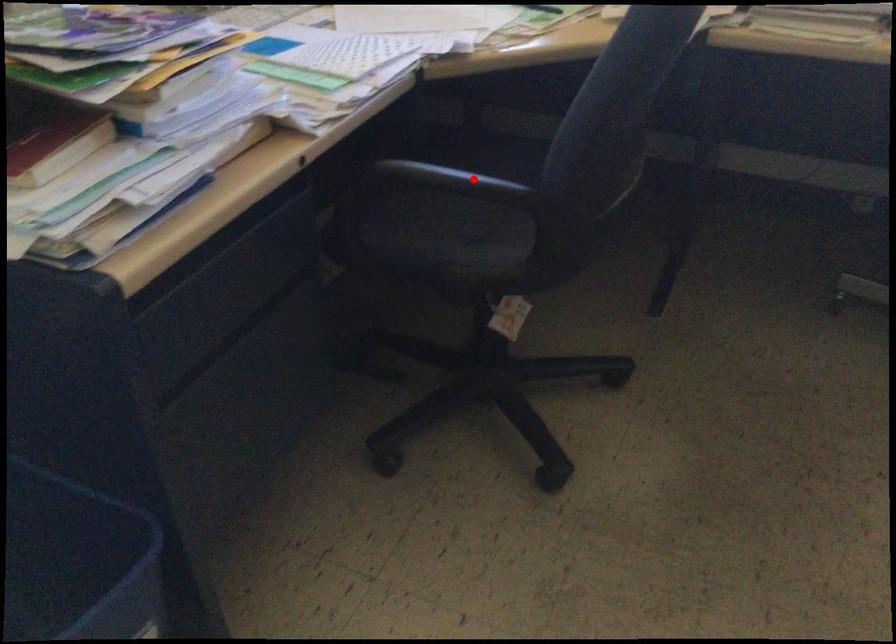
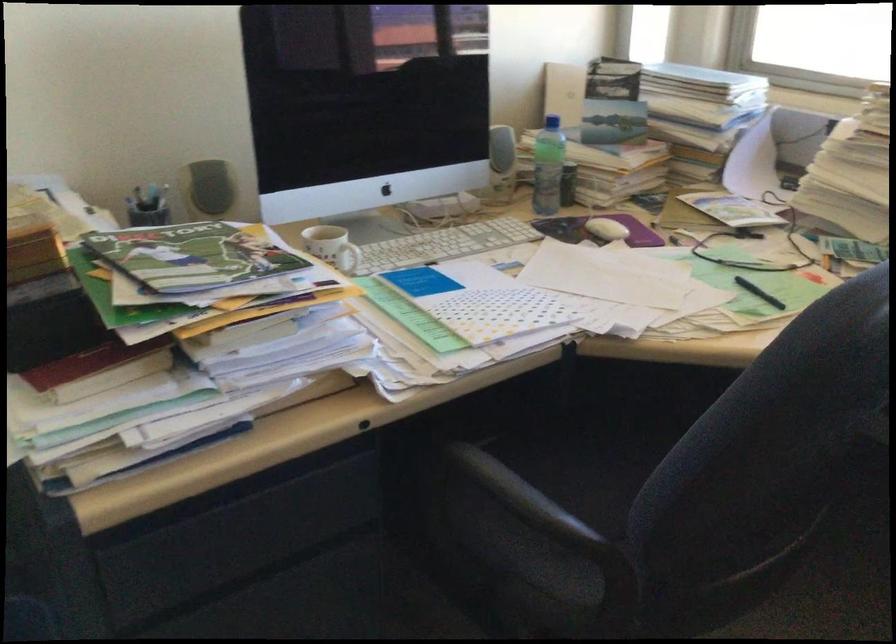
The point at the highlighted location is marked in the first image. Where is the corresponding point in the second image?

(532, 506)